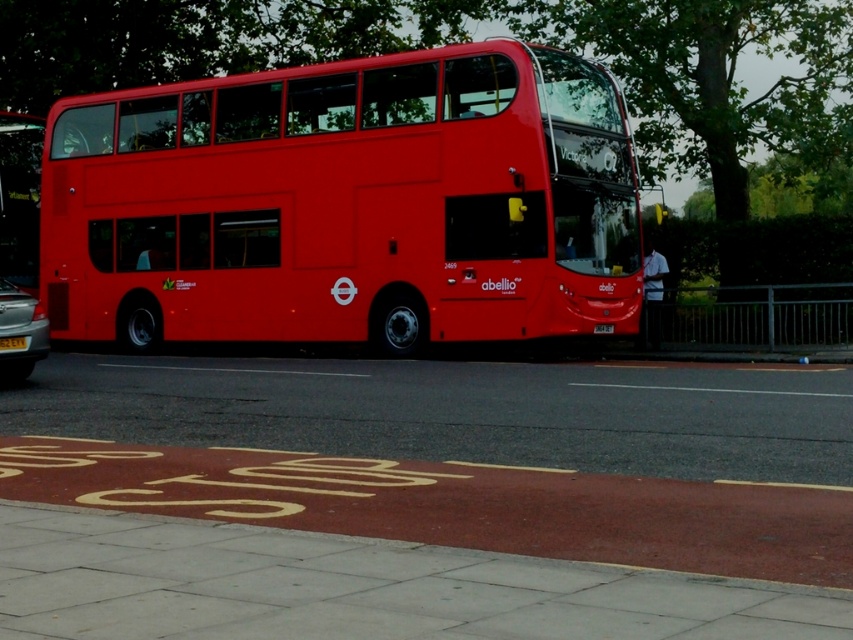
You are a parking attendant checking the width of vehicles. You see the metallic silver car at left and the yellow matte license plate at center. Which one has a greater width?

The metallic silver car at left has a greater width than the yellow matte license plate at center.

You are a delivery person trying to load a package onto a truck that requires a clearance height of 3 meters. You see the shiny red bus at center and the metallic silver car at left in the scene. Which vehicle do you think would block the truck from passing due to height restrictions?

The shiny red bus at center is much taller than the metallic silver car at left, so it would block the truck from passing due to its height.